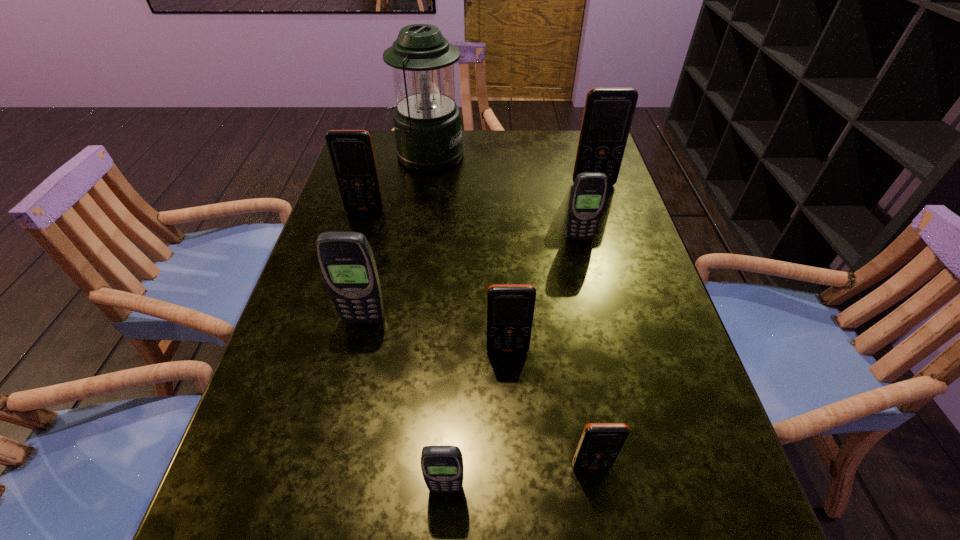
Where is `the second smallest orange cellular telephone`? the second smallest orange cellular telephone is located at coordinates (510, 307).

You are a GUI agent. You are given a task and a screenshot of the screen. Output one action in this format:
    pyautogui.click(x=<x>, y=<y>)
    Task: Click on the third orange cellular telephone from right to left
    Image resolution: width=960 pixels, height=540 pixels.
    Given the screenshot: What is the action you would take?
    pyautogui.click(x=510, y=307)

Locate an element on the screen. Image resolution: width=960 pixels, height=540 pixels. the second nearest cellular telephone is located at coordinates (600, 444).

Image resolution: width=960 pixels, height=540 pixels. Find the location of `the second nearest object`. the second nearest object is located at coordinates (600, 444).

Where is `the nearest cellular telephone`? The height and width of the screenshot is (540, 960). the nearest cellular telephone is located at coordinates (442, 466).

Where is `the fifth cellular telephone from right to left`? the fifth cellular telephone from right to left is located at coordinates (442, 466).

The width and height of the screenshot is (960, 540). Identify the location of free location located on the front of the farthest object. (420, 201).

Identify the location of free space located 0.100m on the screen of the tallest cellular telephone. (602, 210).

At what (x,y) coordinates should I click in order to perform the action: click on vacant position located on the screen of the third smallest orange cellular telephone. Please return your answer as a coordinate pair (x, y). The height and width of the screenshot is (540, 960). Looking at the image, I should click on (339, 299).

I want to click on free space located 0.330m on the screen of the fourth farthest cellular telephone, so click(322, 498).